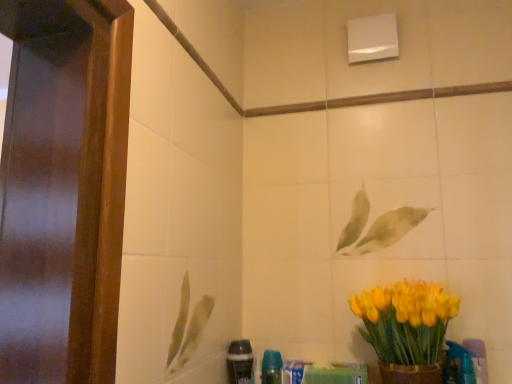
The height and width of the screenshot is (384, 512). What do you see at coordinates (406, 328) in the screenshot?
I see `yellow matte flowers at lower right` at bounding box center [406, 328].

From the picture: What is the approximate height of yellow matte flowers at lower right?

yellow matte flowers at lower right is 30.81 centimeters tall.

I want to click on yellow matte flowers at lower right, so click(x=406, y=328).

From the picture: In order to face yellow matte flowers at lower right, should I rotate leftwards or rightwards?

To face it directly, rotate right by 19.500 degrees.

Image resolution: width=512 pixels, height=384 pixels. What are the coordinates of `yellow matte flowers at lower right` in the screenshot? It's located at (406, 328).